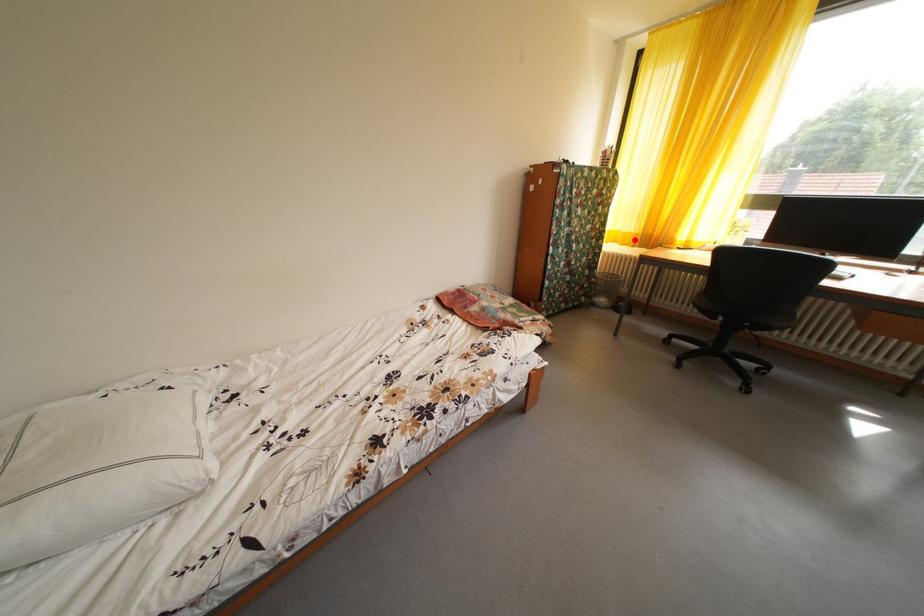
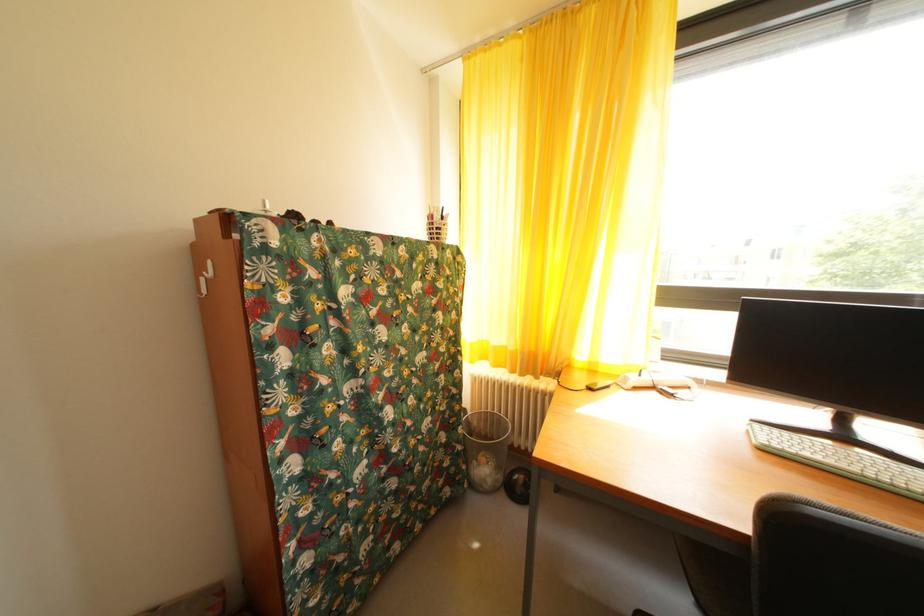
Locate, in the second image, the point that corresponds to the highlighted location in the first image.

(505, 354)